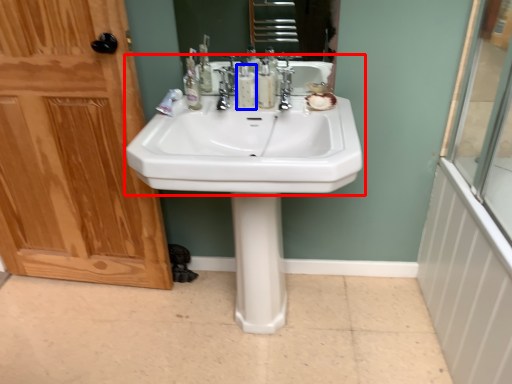
Question: Which object is closer to the camera taking this photo, sink (highlighted by a red box) or mouthwash (highlighted by a blue box)?

Choices:
 (A) sink
 (B) mouthwash

Answer: (A)